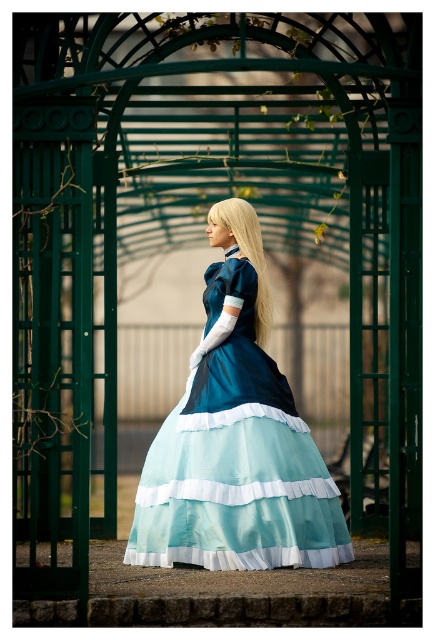
You are a photographer planning to take a portrait of the person in the image. Considering the matte blue dress at center and the blonde silky hair at center, which one should you focus on to ensure the subject is clearly visible in the photo?

The matte blue dress at center has a larger size compared to the blonde silky hair at center, so focusing on the matte blue dress at center will ensure the subject is clearly visible in the photo.

You are a photographer setting up for a portrait. The subject is wearing a matte blue dress at center and has blonde silky hair at center. You need to ensure the dress is visible without being obscured by the hair. Based on their sizes, is this arrangement feasible?

The matte blue dress at center is wider than the blonde silky hair at center, so the dress will not be obscured by the hair in this arrangement.